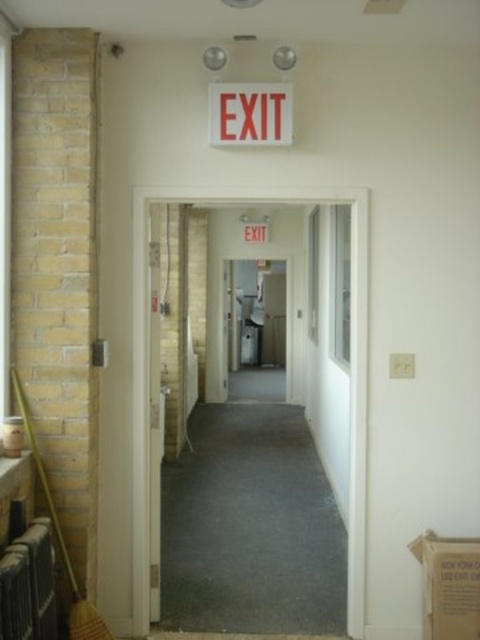
Between cardboard box at lower right and red plastic exit sign at upper center, which one is positioned lower?

cardboard box at lower right is below.

Between point (418, 556) and point (241, 131), which one is positioned in front?

Point (241, 131)

The image size is (480, 640). Identify the location of cardboard box at lower right. (448, 586).

Who is taller, smooth gray carpet at center or red plastic exit sign at upper center?

With more height is smooth gray carpet at center.

Based on the photo, between smooth gray carpet at center and red plastic exit sign at upper center, which one appears on the right side from the viewer's perspective?

red plastic exit sign at upper center

Which is behind, point (145, 205) or point (264, 115)?

The point (145, 205) is behind.

Image resolution: width=480 pixels, height=640 pixels. What are the coordinates of `smooth gray carpet at center` in the screenshot? It's located at (350, 339).

Between smooth gray carpet at center and cardboard box at lower right, which one is positioned lower?

Positioned lower is cardboard box at lower right.

Is smooth gray carpet at center smaller than cardboard box at lower right?

Yes.

This screenshot has width=480, height=640. Identify the location of smooth gray carpet at center. (350, 339).